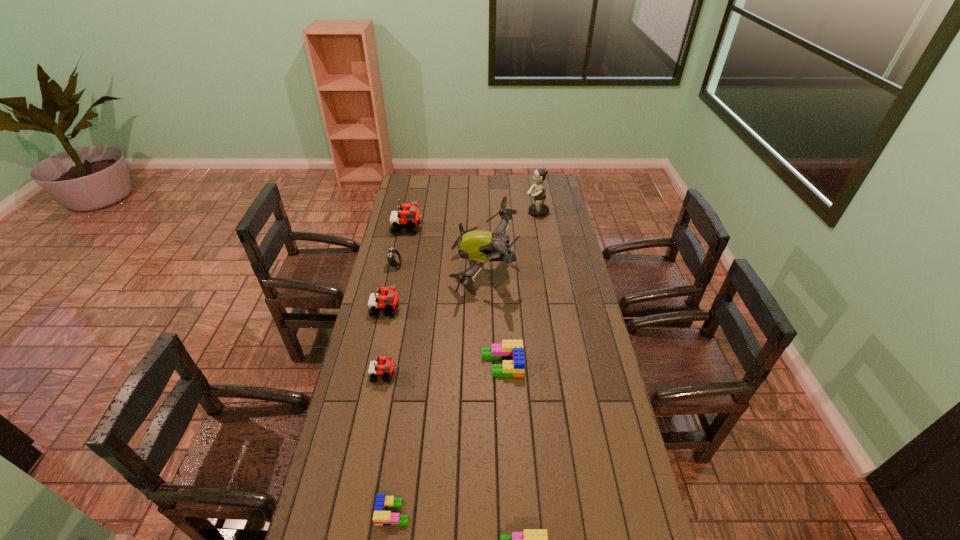
Point out which object is positioned as the seventh nearest to the nearest red Lego. Please provide its 2D coordinates. Your answer should be formatted as a tuple, i.e. [(x, y)], where the tuple contains the x and y coordinates of a point satisfying the conditions above.

[(409, 217)]

Identify the location of object that is the fourth closest one to the farthest green Lego. The height and width of the screenshot is (540, 960). (381, 517).

Locate which Lego is the second closest to the third shortest object. Please provide its 2D coordinates. Your answer should be formatted as a tuple, i.e. [(x, y)], where the tuple contains the x and y coordinates of a point satisfying the conditions above.

[(391, 300)]

This screenshot has width=960, height=540. I want to click on Lego that is the fourth closest to the alarm clock, so click(511, 352).

At what (x,y) coordinates should I click in order to perform the action: click on red Lego that is the closest to the smallest red Lego. Please return your answer as a coordinate pair (x, y). This screenshot has width=960, height=540. Looking at the image, I should click on (391, 300).

This screenshot has height=540, width=960. I want to click on the closest red Lego to the green figurine, so click(x=409, y=217).

Find the location of a particular element. The width and height of the screenshot is (960, 540). green Lego that is the second nearest to the green drone is located at coordinates (381, 517).

Select which green Lego is the third closest to the drone. Please provide its 2D coordinates. Your answer should be formatted as a tuple, i.e. [(x, y)], where the tuple contains the x and y coordinates of a point satisfying the conditions above.

[(530, 539)]

Where is `free location that satisfies the following two spatial constraints: 1. on the face of the smallest green Lego; 2. on the right side of the white alarm clock`? This screenshot has width=960, height=540. free location that satisfies the following two spatial constraints: 1. on the face of the smallest green Lego; 2. on the right side of the white alarm clock is located at coordinates (341, 512).

At what (x,y) coordinates should I click in order to perform the action: click on vacant space that satisfies the following two spatial constraints: 1. on the front-facing side of the biggest green Lego; 2. on the left side of the second nearest red Lego. Please return your answer as a coordinate pair (x, y). The width and height of the screenshot is (960, 540). Looking at the image, I should click on (374, 364).